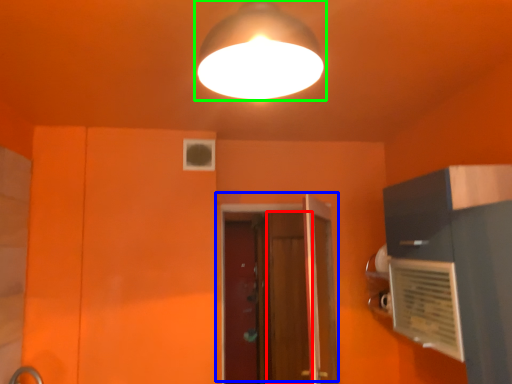
Question: Which object is positioned farthest from screen door (highlighted by a red box)? Select from door (highlighted by a blue box) and lamp (highlighted by a green box).

Choices:
 (A) door
 (B) lamp

Answer: (B)